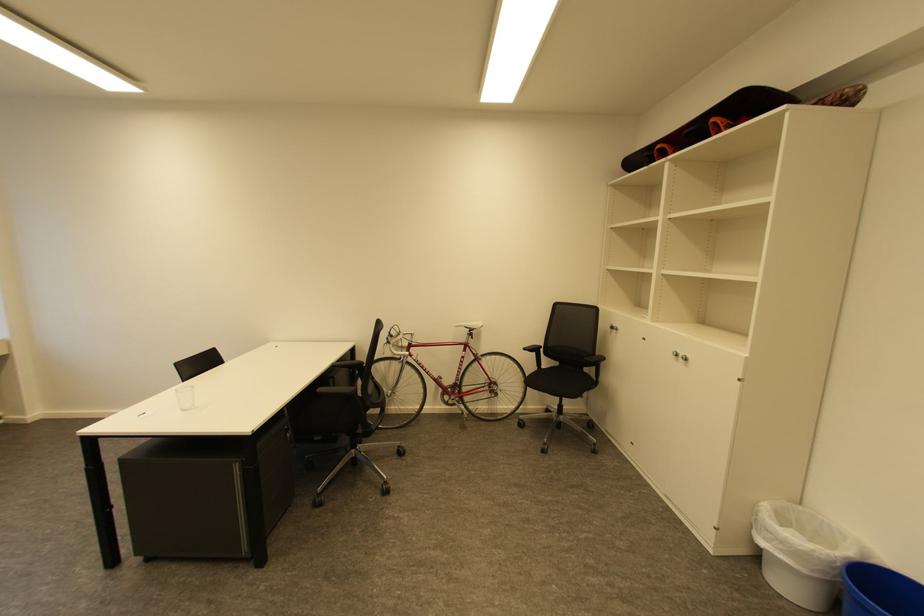
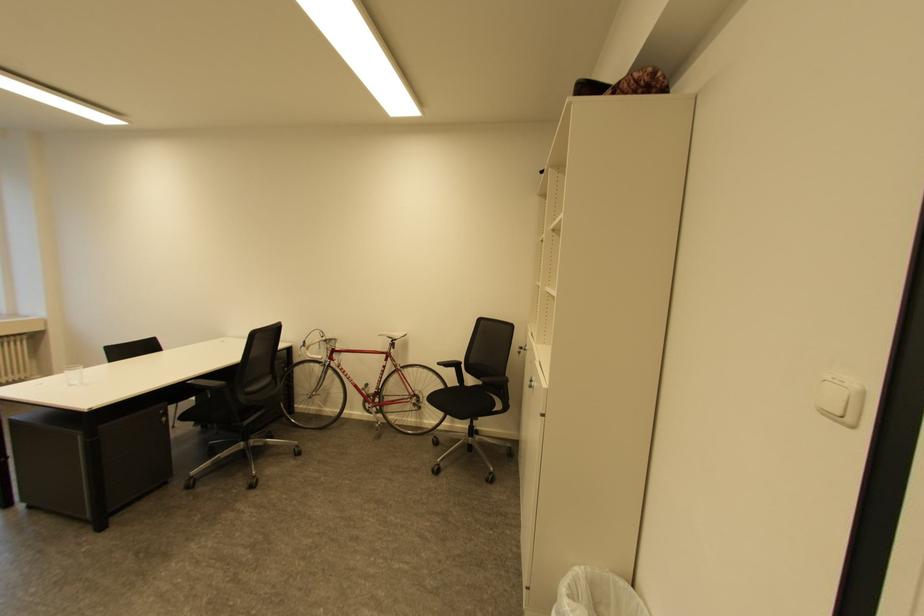
Locate, in the second image, the point that corresponds to point (541, 354) in the first image.

(459, 370)